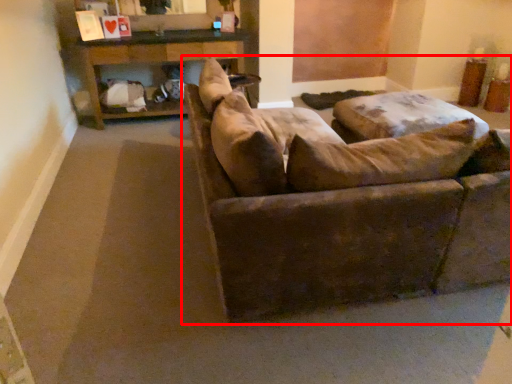
Question: From the image's perspective, where is studio couch (annotated by the red box) located in relation to table in the image?

Choices:
 (A) below
 (B) above

Answer: (A)